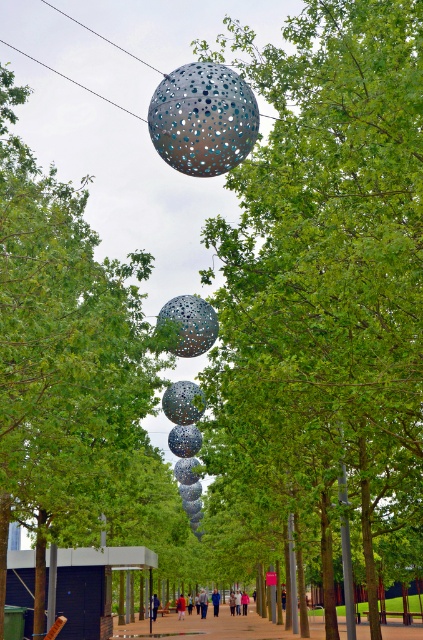
Between concrete sidewalk at center and light blue denim jacket at center, which one has more height?

Standing taller between the two is concrete sidewalk at center.

Does concrete sidewalk at center have a larger size compared to light blue denim jacket at center?

Indeed, concrete sidewalk at center has a larger size compared to light blue denim jacket at center.

Is point (184, 628) farther from viewer compared to point (202, 588)?

That is False.

At what (x,y) coordinates should I click in order to perform the action: click on concrete sidewalk at center. Please return your answer as a coordinate pair (x, y). Image resolution: width=423 pixels, height=640 pixels. Looking at the image, I should click on (220, 627).

Who is more distant from viewer, (371, 605) or (180, 618)?

Point (180, 618)

Is point (222, 45) farther from viewer compared to point (178, 611)?

No.

Locate an element on the screen. This screenshot has height=640, width=423. green leafy tree at center is located at coordinates (327, 280).

Is point (151, 605) behind point (202, 602)?

No, it is in front of (202, 602).

I want to click on blue fabric jacket at center, so click(x=153, y=605).